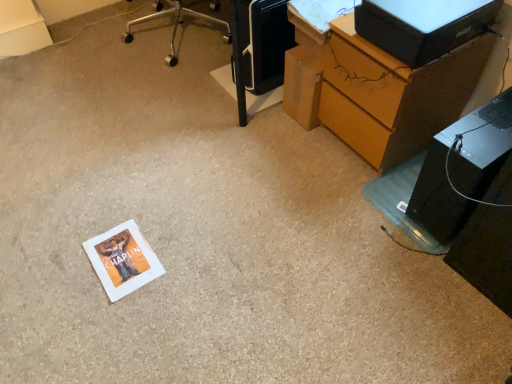
The height and width of the screenshot is (384, 512). What do you see at coordinates (423, 26) in the screenshot?
I see `black plastic desktop computer at upper right` at bounding box center [423, 26].

Locate an element on the screen. The image size is (512, 384). wooden desk at lower right is located at coordinates (376, 90).

Relative to black plastic desktop computer at upper right, is wooden desk at lower right in front or behind?

In the image, wooden desk at lower right appears behind black plastic desktop computer at upper right.

This screenshot has width=512, height=384. Find the location of `desktop computer positioned vertically above the wooden desk at lower right (from a real-world perspective)`. desktop computer positioned vertically above the wooden desk at lower right (from a real-world perspective) is located at coordinates (423, 26).

Is point (318, 62) less distant than point (453, 44)?

No, (318, 62) is behind (453, 44).

Can you confirm if black plastic printer at upper center is shorter than black plastic desktop computer at upper right?

No.

Is black plastic printer at upper center spatially inside black plastic desktop computer at upper right, or outside of it?

black plastic printer at upper center exists outside the volume of black plastic desktop computer at upper right.

Is black plastic printer at upper center positioned before black plastic desktop computer at upper right?

No, the depth of black plastic printer at upper center is greater than that of black plastic desktop computer at upper right.

How different are the orientations of black plastic computer tower at lower right and black plastic printer at upper center in degrees?

black plastic computer tower at lower right and black plastic printer at upper center are facing 3.02 degrees away from each other.

Between point (501, 99) and point (263, 75), which one is positioned in front?

Point (501, 99)

Which of these two, black plastic computer tower at lower right or black plastic printer at upper center, is thinner?

black plastic computer tower at lower right.

From the image's perspective, between black plastic computer tower at lower right and black plastic printer at upper center, who is located below?

From the image's view, black plastic computer tower at lower right is below.

Where is `furniture that is behind the black plastic desktop computer at upper right`? The image size is (512, 384). furniture that is behind the black plastic desktop computer at upper right is located at coordinates (258, 47).

Measure the distance between black plastic desktop computer at upper right and black plastic printer at upper center.

24.94 inches.

Between black plastic desktop computer at upper right and black plastic printer at upper center, which one has less height?

black plastic desktop computer at upper right is shorter.

Which object is thinner, black plastic desktop computer at upper right or black plastic printer at upper center?

black plastic desktop computer at upper right is thinner.

From the image's perspective, would you say black plastic desktop computer at upper right is positioned over black plastic computer tower at lower right?

Yes, from the image's perspective, black plastic desktop computer at upper right is over black plastic computer tower at lower right.

Could you tell me if black plastic desktop computer at upper right is facing black plastic computer tower at lower right?

No, black plastic desktop computer at upper right does not turn towards black plastic computer tower at lower right.

Is black plastic desktop computer at upper right wider or thinner than black plastic computer tower at lower right?

Considering their sizes, black plastic desktop computer at upper right looks slimmer than black plastic computer tower at lower right.

Is black plastic desktop computer at upper right outside of black plastic computer tower at lower right?

Indeed, black plastic desktop computer at upper right is completely outside black plastic computer tower at lower right.

How far apart are black plastic computer tower at lower right and wooden desk at lower right?

13.98 inches.

From the image's perspective, is black plastic computer tower at lower right over wooden desk at lower right?

No, from the image's perspective, black plastic computer tower at lower right is not over wooden desk at lower right.

Find the location of a particular element. The image size is (512, 384). computer tower below the wooden desk at lower right (from a real-world perspective) is located at coordinates (461, 168).

In the scene shown: Is black plastic computer tower at lower right facing towards wooden desk at lower right?

No, black plastic computer tower at lower right is not facing towards wooden desk at lower right.

From the image's perspective, is wooden desk at lower right positioned above or below black plastic computer tower at lower right?

From the image's perspective, wooden desk at lower right appears above black plastic computer tower at lower right.

From a real-world perspective, is wooden desk at lower right physically below black plastic computer tower at lower right?

No, from a real-world perspective, wooden desk at lower right is not under black plastic computer tower at lower right.

Considering the sizes of objects wooden desk at lower right and black plastic computer tower at lower right in the image provided, who is thinner, wooden desk at lower right or black plastic computer tower at lower right?

Thinner between the two is black plastic computer tower at lower right.

From the picture: Is wooden desk at lower right in front of or behind black plastic computer tower at lower right in the image?

wooden desk at lower right is behind black plastic computer tower at lower right.

Where is `desktop computer that appears on the right of wooden desk at lower right`? desktop computer that appears on the right of wooden desk at lower right is located at coordinates (423, 26).

The image size is (512, 384). In order to click on furniture to the left of black plastic desktop computer at upper right in this screenshot , I will do `click(258, 47)`.

Based on their spatial positions, is black plastic desktop computer at upper right or black plastic printer at upper center further from wooden desk at lower right?

black plastic printer at upper center is further to wooden desk at lower right.

From the image, which object appears to be nearer to black plastic computer tower at lower right, black plastic printer at upper center or black plastic desktop computer at upper right?

black plastic desktop computer at upper right is positioned closer to the anchor black plastic computer tower at lower right.

Looking at this image, looking at the image, which one is located closer to wooden desk at lower right, black plastic computer tower at lower right or black plastic printer at upper center?

The object closer to wooden desk at lower right is black plastic computer tower at lower right.

Considering their positions, is black plastic printer at upper center positioned closer to wooden desk at lower right than black plastic computer tower at lower right?

black plastic computer tower at lower right lies closer to wooden desk at lower right than the other object.

Considering their positions, is black plastic printer at upper center positioned further to black plastic computer tower at lower right than wooden desk at lower right?

Among the two, black plastic printer at upper center is located further to black plastic computer tower at lower right.

From the image, which object appears to be nearer to black plastic computer tower at lower right, black plastic desktop computer at upper right or black plastic printer at upper center?

black plastic desktop computer at upper right is closer to black plastic computer tower at lower right.

From the image, which object appears to be farther from black plastic desktop computer at upper right, wooden desk at lower right or black plastic computer tower at lower right?

black plastic computer tower at lower right is further to black plastic desktop computer at upper right.

Looking at the image, which one is located further to wooden desk at lower right, black plastic desktop computer at upper right or black plastic computer tower at lower right?

black plastic computer tower at lower right is further to wooden desk at lower right.

What are the coordinates of `desk situated between black plastic printer at upper center and black plastic computer tower at lower right from left to right` in the screenshot? It's located at (376, 90).

The image size is (512, 384). I want to click on desk that lies between black plastic desktop computer at upper right and black plastic computer tower at lower right from top to bottom, so click(x=376, y=90).

Find the location of a particular element. desktop computer between black plastic printer at upper center and black plastic computer tower at lower right vertically is located at coordinates (423, 26).

The width and height of the screenshot is (512, 384). I want to click on desk located between black plastic printer at upper center and black plastic desktop computer at upper right in the left-right direction, so click(x=376, y=90).